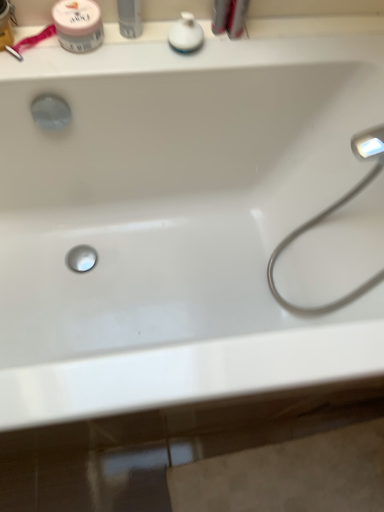
This screenshot has height=512, width=384. Find the location of `vacant space to the right of white glossy spray can at upper center, which is the 1th toiletry in left-to-right order`. vacant space to the right of white glossy spray can at upper center, which is the 1th toiletry in left-to-right order is located at coordinates (193, 48).